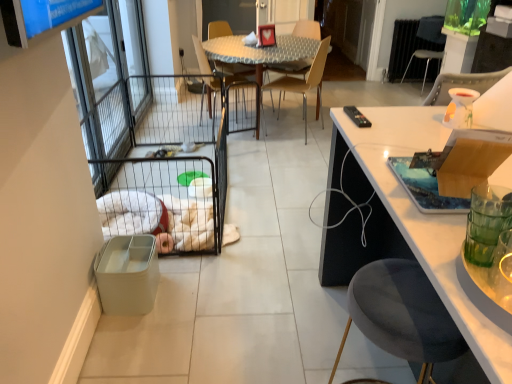
Image resolution: width=512 pixels, height=384 pixels. In order to click on free point above velvet grey bar stool at lower right, arranged as the 4th chair when viewed from the back (from a real-world perspective) in this screenshot , I will do `click(399, 291)`.